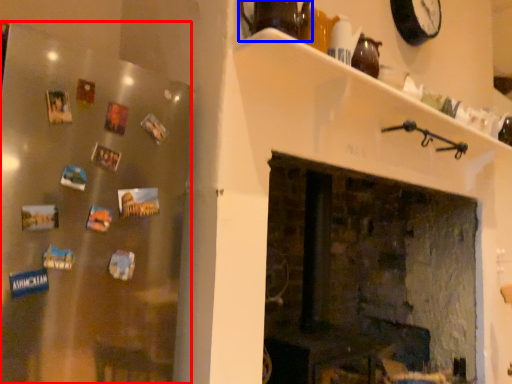
Question: Which object is further to the camera taking this photo, fridge (highlighted by a red box) or tea pot (highlighted by a blue box)?

Choices:
 (A) fridge
 (B) tea pot

Answer: (B)